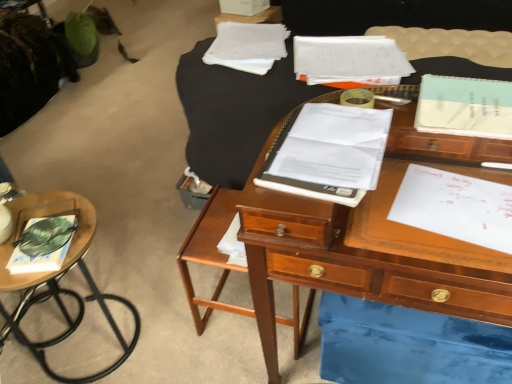
In order to face white paper at right, should I rotate leftwards or rightwards?

You should look right and rotate roughly 26.564 degrees.

Identify the location of wooden side table at lower left, positioned as the first table in left-to-right order. The image size is (512, 384). (59, 276).

Locate an element on the screen. This screenshot has height=384, width=512. light blue spiral notebook at upper right, the 2th notebook in the back-to-front sequence is located at coordinates (465, 107).

This screenshot has height=384, width=512. I want to click on wooden desk at center, the first table positioned from the right, so click(234, 113).

Which is in front, point (12, 317) or point (441, 97)?

The point (441, 97) is closer.

Considering the relative sizes of wooden side table at lower left, positioned as the first table in left-to-right order, and light blue spiral notebook at upper right, the first notebook when ordered from right to left, in the image provided, is wooden side table at lower left, positioned as the first table in left-to-right order, thinner than light blue spiral notebook at upper right, the first notebook when ordered from right to left,?

No.

How many degrees apart are the facing directions of wooden side table at lower left, the second table viewed from the right, and light blue spiral notebook at upper right, the first notebook when ordered from right to left?

The facing directions of wooden side table at lower left, the second table viewed from the right, and light blue spiral notebook at upper right, the first notebook when ordered from right to left, are 177 degrees apart.

Measure the distance from wooden side table at lower left, the second table viewed from the right, to light blue spiral notebook at upper right, the 2th notebook in the bottom-to-top sequence.

4.55 feet.

Can you tell me how much white paper at right and light blue spiral notebook at upper right, the 2th notebook in the back-to-front sequence, differ in facing direction?

10.7 degrees separate the facing orientations of white paper at right and light blue spiral notebook at upper right, the 2th notebook in the back-to-front sequence.

The height and width of the screenshot is (384, 512). What are the coordinates of `notebook on the right side of white paper at right` in the screenshot? It's located at (465, 107).

Can we say white paper at right lies outside light blue spiral notebook at upper right, the 2th notebook in the bottom-to-top sequence?

Yes, white paper at right is not within light blue spiral notebook at upper right, the 2th notebook in the bottom-to-top sequence.

Is white paper at right positioned far away from light blue spiral notebook at upper right, the second notebook from the front?

white paper at right is near light blue spiral notebook at upper right, the second notebook from the front, not far away.

Identify the location of document lying on the left of wooden desk at center, positioned as the second table in left-to-right order. (455, 207).

Can white paper at right be found inside wooden desk at center, the first table positioned from the right?

That's incorrect, white paper at right is not inside wooden desk at center, the first table positioned from the right.

Who is smaller, wooden desk at center, the first table positioned from the right, or white paper at right?

white paper at right is smaller.

Which is closer, [213,176] or [410,208]?

Positioned in front is point [410,208].

From a real-world perspective, is light blue spiral notebook at upper right, the 3th notebook viewed from the left, located beneath hardcover book at left?

No, from a real-world perspective, light blue spiral notebook at upper right, the 3th notebook viewed from the left, is not under hardcover book at left.

Could you tell me if light blue spiral notebook at upper right, the first notebook when ordered from right to left, is facing hardcover book at left?

No, light blue spiral notebook at upper right, the first notebook when ordered from right to left, does not turn towards hardcover book at left.

Considering the relative positions of light blue spiral notebook at upper right, positioned as the second notebook in top-to-bottom order, and hardcover book at left in the image provided, is light blue spiral notebook at upper right, positioned as the second notebook in top-to-bottom order, to the left of hardcover book at left from the viewer's perspective?

No, light blue spiral notebook at upper right, positioned as the second notebook in top-to-bottom order, is not to the left of hardcover book at left.

Considering the sizes of objects white paper at right and wooden desk at center, the first table positioned from the right, in the image provided, who is shorter, white paper at right or wooden desk at center, the first table positioned from the right,?

white paper at right is shorter.

Are white paper at right and wooden desk at center, positioned as the second table in left-to-right order, located far from each other?

No, white paper at right is not far away from wooden desk at center, positioned as the second table in left-to-right order.

Is white paper at right positioned with its back to wooden desk at center, the first table positioned from the right?

That's right, white paper at right is facing away from wooden desk at center, the first table positioned from the right.

Consider the image. How different are the orientations of light blue spiral notebook at upper right, the 3th notebook viewed from the left, and wooden side table at lower left, the second table viewed from the right, in degrees?

light blue spiral notebook at upper right, the 3th notebook viewed from the left, and wooden side table at lower left, the second table viewed from the right, are facing 177 degrees away from each other.

Is light blue spiral notebook at upper right, the first notebook when ordered from right to left, bigger or smaller than wooden side table at lower left, positioned as the first table in left-to-right order?

Clearly, light blue spiral notebook at upper right, the first notebook when ordered from right to left, is smaller in size than wooden side table at lower left, positioned as the first table in left-to-right order.

Is light blue spiral notebook at upper right, the 2th notebook in the bottom-to-top sequence, to the right of wooden side table at lower left, the second table viewed from the right, from the viewer's perspective?

Yes.

Which point is more distant from viewer, (417, 129) or (71, 194)?

Positioned behind is point (71, 194).

Is white paper notebook at center, arranged as the first notebook when ordered from the bottom, taller than wooden side table at lower left, the second table viewed from the right?

No.

From the image's perspective, between white paper notebook at center, arranged as the first notebook when ordered from the bottom, and wooden side table at lower left, positioned as the first table in left-to-right order, which one is located above?

From the image's view, white paper notebook at center, arranged as the first notebook when ordered from the bottom, is above.

Consider the image. Does white paper notebook at center, the 2th notebook positioned from the right, come behind wooden side table at lower left, the second table viewed from the right?

No, white paper notebook at center, the 2th notebook positioned from the right, is in front of wooden side table at lower left, the second table viewed from the right.

Is white paper notebook at center, positioned as the first notebook in front-to-back order, at the right side of wooden side table at lower left, the second table viewed from the right?

Indeed, white paper notebook at center, positioned as the first notebook in front-to-back order, is positioned on the right side of wooden side table at lower left, the second table viewed from the right.

Starting from the light blue spiral notebook at upper right, the second notebook from the front, which table is the 2nd one to the left? Please provide its 2D coordinates.

[(59, 276)]

From the image's perspective, count 2nd notebooks upward from the white paper at right and point to it. Please provide its 2D coordinates.

[(465, 107)]

Based on their spatial positions, is wooden desk at center, positioned as the second table in left-to-right order, or wooden side table at lower left, positioned as the first table in left-to-right order, closer to hardcover book at left?

Based on the image, wooden side table at lower left, positioned as the first table in left-to-right order, appears to be nearer to hardcover book at left.

Based on their spatial positions, is light blue spiral notebook at upper right, the 2th notebook in the bottom-to-top sequence, or white paper notebook at upper center, the 1th notebook when ordered from back to front, further from white paper at right?

white paper notebook at upper center, the 1th notebook when ordered from back to front.

Considering their positions, is white paper notebook at upper center, positioned as the 1th notebook in top-to-bottom order, positioned further to white paper at right than white paper notebook at center, which is the second notebook in left-to-right order?

The object further to white paper at right is white paper notebook at upper center, positioned as the 1th notebook in top-to-bottom order.

From the image, which object appears to be nearer to wooden side table at lower left, positioned as the first table in left-to-right order, wooden desk at center, positioned as the second table in left-to-right order, or white paper at right?

Among the two, wooden desk at center, positioned as the second table in left-to-right order, is located nearer to wooden side table at lower left, positioned as the first table in left-to-right order.

When comparing their distances from wooden desk at center, the first table positioned from the right, does white paper notebook at center, the third notebook when ordered from back to front, or light blue spiral notebook at upper right, the 3th notebook viewed from the left, seem closer?

Among the two, white paper notebook at center, the third notebook when ordered from back to front, is located nearer to wooden desk at center, the first table positioned from the right.

When comparing their distances from wooden side table at lower left, the second table viewed from the right, does hardcover book at left or wooden desk at center, positioned as the second table in left-to-right order, seem further?

Based on the image, wooden desk at center, positioned as the second table in left-to-right order, appears to be further to wooden side table at lower left, the second table viewed from the right.

When comparing their distances from light blue spiral notebook at upper right, the 2th notebook in the bottom-to-top sequence, does white paper notebook at center, the 2th notebook positioned from the right, or white paper at right seem closer?

The object closer to light blue spiral notebook at upper right, the 2th notebook in the bottom-to-top sequence, is white paper at right.

When comparing their distances from wooden side table at lower left, positioned as the first table in left-to-right order, does light blue spiral notebook at upper right, the first notebook when ordered from right to left, or hardcover book at left seem closer?

hardcover book at left.

This screenshot has height=384, width=512. I want to click on book between wooden side table at lower left, the second table viewed from the right, and white paper at right, so click(42, 244).

Identify the location of notebook located between white paper notebook at upper center, the 3th notebook when ordered from front to back, and wooden desk at center, positioned as the second table in left-to-right order, in the left-right direction. The width and height of the screenshot is (512, 384). (328, 153).

This screenshot has height=384, width=512. In order to click on notebook situated between wooden side table at lower left, positioned as the first table in left-to-right order, and white paper notebook at center, positioned as the first notebook in front-to-back order, from left to right in this screenshot , I will do `click(247, 46)`.

Find the location of a particular element. This screenshot has width=512, height=384. book between wooden side table at lower left, the second table viewed from the right, and white paper notebook at center, which is the second notebook in left-to-right order is located at coordinates (42, 244).